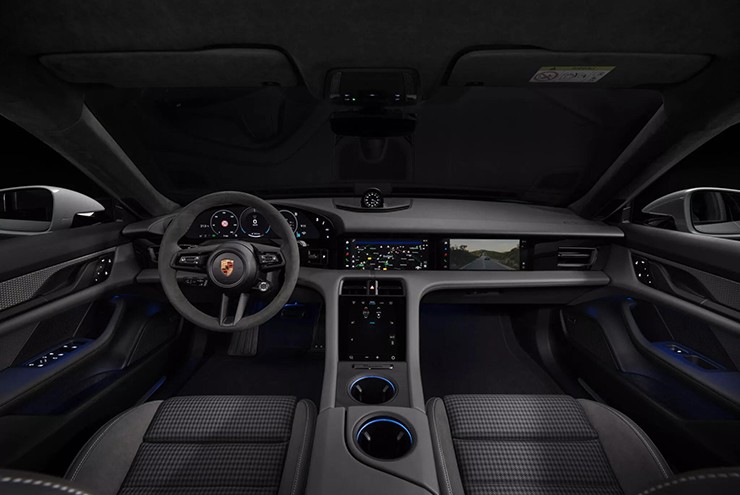
I want to click on cup holders, so click(380, 437), click(370, 389).